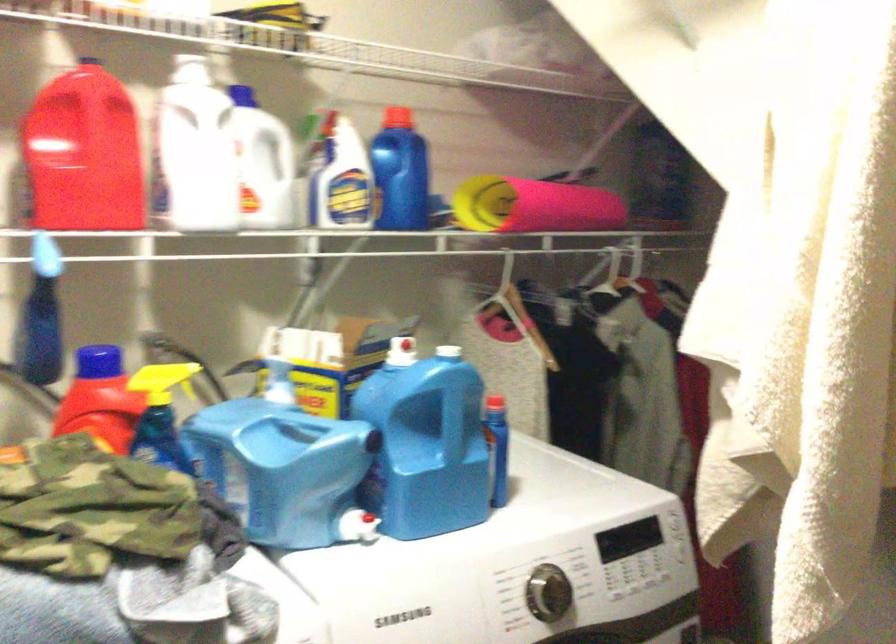
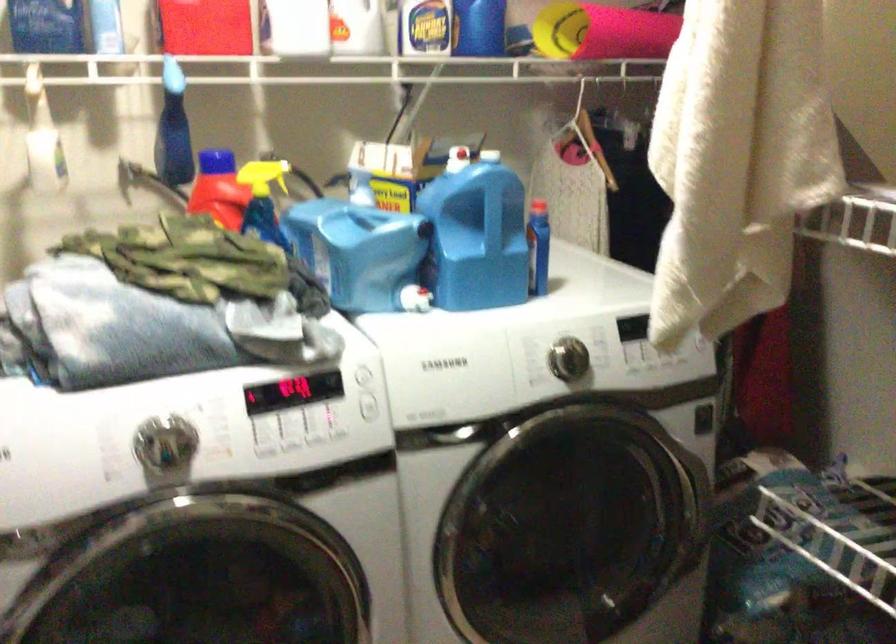
Question: I am providing you with two images of the same scene from different viewpoints. Please identify which objects are invisible in image2.

Choices:
 (A) red plastic container
 (B) washer door handle
 (C) rolled pink mat
 (D) none of these

Answer: (D)